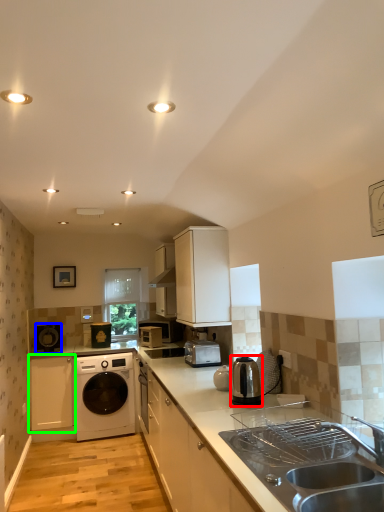
Question: Based on their relative distances, which object is farther from home appliance (highlighted by a red box)? Choose from home appliance (highlighted by a blue box) and cabinetry (highlighted by a green box).

Choices:
 (A) home appliance
 (B) cabinetry

Answer: (A)